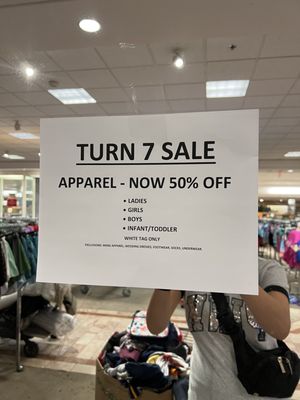
You are a GUI agent. You are given a task and a screenshot of the screen. Output one action in this format:
    pyautogui.click(x=<x>, y=<y>)
    Task: Click on the basket
    
    Given the screenshot: What is the action you would take?
    pyautogui.click(x=106, y=390)